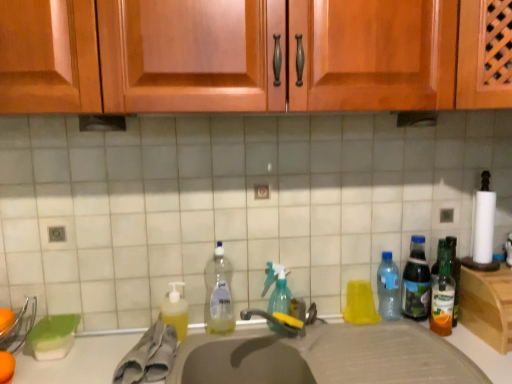
Question: Considering the relative sizes of translucent plastic bottle at right, the fourth bottle viewed from the left, and clear plastic bottle at center, placed as the 5th bottle when sorted from right to left, in the image provided, is translucent plastic bottle at right, the fourth bottle viewed from the left, taller than clear plastic bottle at center, placed as the 5th bottle when sorted from right to left,?

Choices:
 (A) no
 (B) yes

Answer: (A)

Question: Does translucent plastic bottle at right, the second bottle when ordered from right to left, turn towards clear plastic bottle at center, placed as the 5th bottle when sorted from right to left?

Choices:
 (A) no
 (B) yes

Answer: (A)

Question: Can you confirm if translucent plastic bottle at right, the second bottle when ordered from right to left, is thinner than clear plastic bottle at center, placed as the 5th bottle when sorted from right to left?

Choices:
 (A) no
 (B) yes

Answer: (A)

Question: Can you confirm if translucent plastic bottle at right, the second bottle when ordered from right to left, is bigger than clear plastic bottle at center, the first bottle from the left?

Choices:
 (A) yes
 (B) no

Answer: (B)

Question: Is the depth of translucent plastic bottle at right, the fourth bottle viewed from the left, greater than that of clear plastic bottle at center, the first bottle from the left?

Choices:
 (A) no
 (B) yes

Answer: (B)

Question: In the image, is gray matte sink at center on the left side or the right side of green glass bottle at right?

Choices:
 (A) right
 (B) left

Answer: (B)

Question: In terms of height, does gray matte sink at center look taller or shorter compared to green glass bottle at right?

Choices:
 (A) short
 (B) tall

Answer: (B)

Question: Is point (318, 342) positioned closer to the camera than point (494, 344)?

Choices:
 (A) farther
 (B) closer

Answer: (A)

Question: Considering their positions, is gray matte sink at center located in front of or behind green glass bottle at right?

Choices:
 (A) behind
 (B) front

Answer: (B)

Question: Is point (214, 269) closer or farther from the camera than point (502, 317)?

Choices:
 (A) closer
 (B) farther

Answer: (B)

Question: Is clear plastic bottle at center, the first bottle from the left, spatially inside green glass bottle at right, or outside of it?

Choices:
 (A) outside
 (B) inside

Answer: (A)

Question: Would you say clear plastic bottle at center, the first bottle from the left, is to the left or to the right of green glass bottle at right in the picture?

Choices:
 (A) left
 (B) right

Answer: (A)

Question: From their relative heights in the image, would you say clear plastic bottle at center, the first bottle from the left, is taller or shorter than green glass bottle at right?

Choices:
 (A) short
 (B) tall

Answer: (B)

Question: From a real-world perspective, is gray fabric towel at sink physically located above or below green glass bottle at right?

Choices:
 (A) above
 (B) below

Answer: (B)

Question: Is point (138, 352) positioned closer to the camera than point (502, 314)?

Choices:
 (A) closer
 (B) farther

Answer: (A)